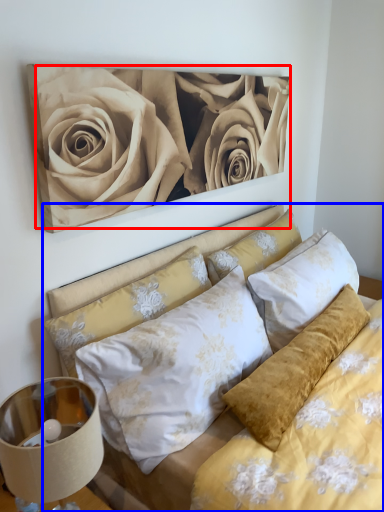
Question: Among these objects, which one is farthest to the camera, rose (highlighted by a red box) or bed (highlighted by a blue box)?

Choices:
 (A) rose
 (B) bed

Answer: (A)